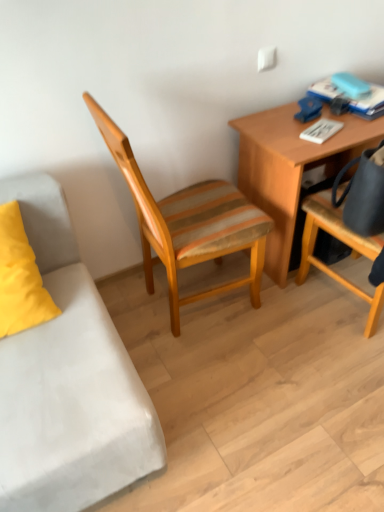
I want to click on vacant space in front of woodenchair at center, which is the second chair in right-to-left order, so click(226, 382).